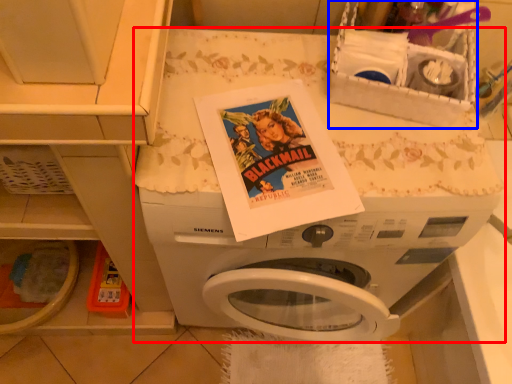
Question: Which object appears closest to the camera in this image, washing machine (highlighted by a red box) or basket (highlighted by a blue box)?

Choices:
 (A) washing machine
 (B) basket

Answer: (B)